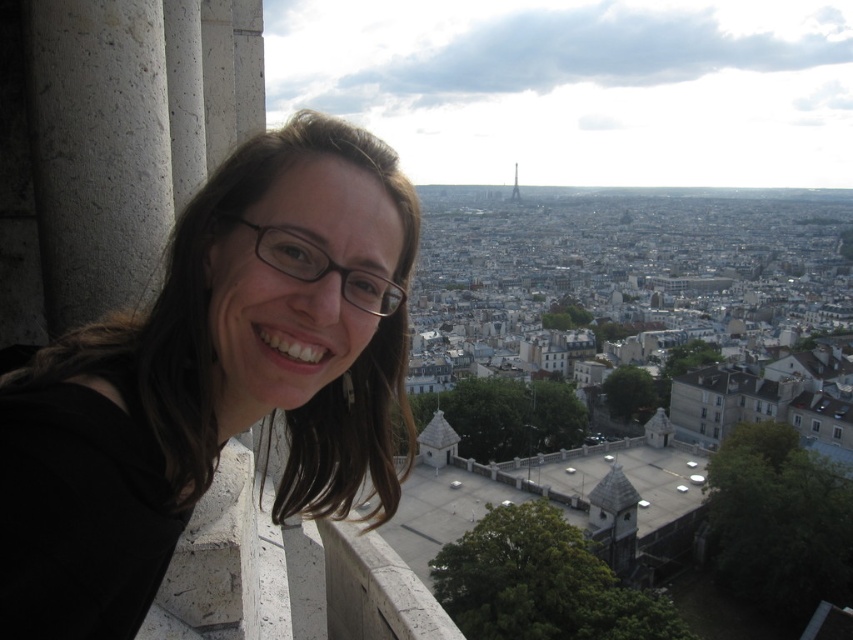
Does matte black hair at left lie in front of metallic gold eiffel tower at center?

Yes, matte black hair at left is in front of metallic gold eiffel tower at center.

Does matte black hair at left appear on the right side of metallic gold eiffel tower at center?

In fact, matte black hair at left is to the left of metallic gold eiffel tower at center.

Is point (1, 609) positioned before point (512, 195)?

Yes, point (1, 609) is closer to viewer.

Locate an element on the screen. This screenshot has height=640, width=853. matte black hair at left is located at coordinates (213, 380).